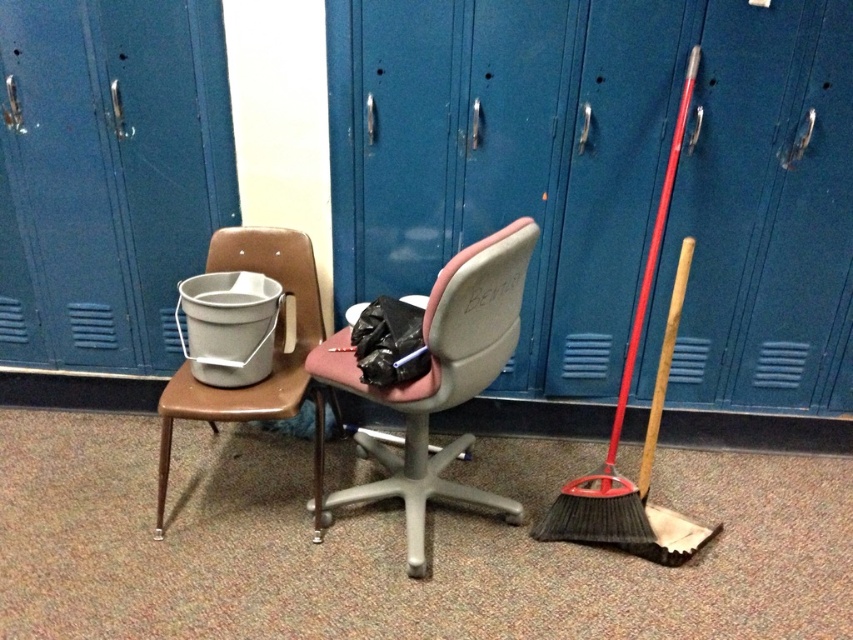
Question: Can you confirm if metallic brown chair at left is bigger than wooden handle broom at right?

Choices:
 (A) no
 (B) yes

Answer: (A)

Question: Estimate the real-world distances between objects in this image. Which object is farther from the pink fabric office chair at center?

Choices:
 (A) metallic brown chair at left
 (B) wooden handle broom at right

Answer: (B)

Question: From the image, what is the correct spatial relationship of metallic brown chair at left in relation to wooden handle broom at right?

Choices:
 (A) above
 (B) below

Answer: (B)

Question: In this image, where is pink fabric office chair at center located relative to metallic brown chair at left?

Choices:
 (A) above
 (B) below

Answer: (A)

Question: Among these objects, which one is farthest from the camera?

Choices:
 (A) pink fabric office chair at center
 (B) metallic brown chair at left
 (C) wooden handle broom at right

Answer: (C)

Question: Based on their relative distances, which object is farther from the wooden handle broom at right?

Choices:
 (A) pink fabric office chair at center
 (B) metallic brown chair at left

Answer: (B)